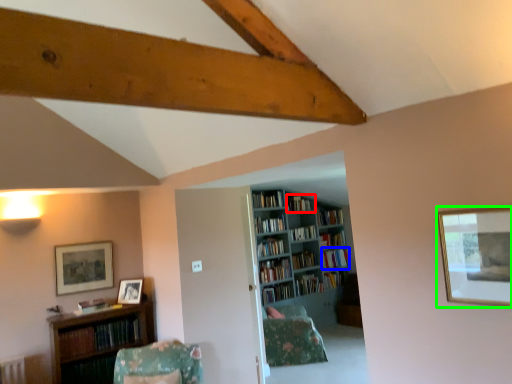
Question: Which is farther away from book (highlighted by a red box)? book (highlighted by a blue box) or picture frame (highlighted by a green box)?

Choices:
 (A) book
 (B) picture frame

Answer: (B)